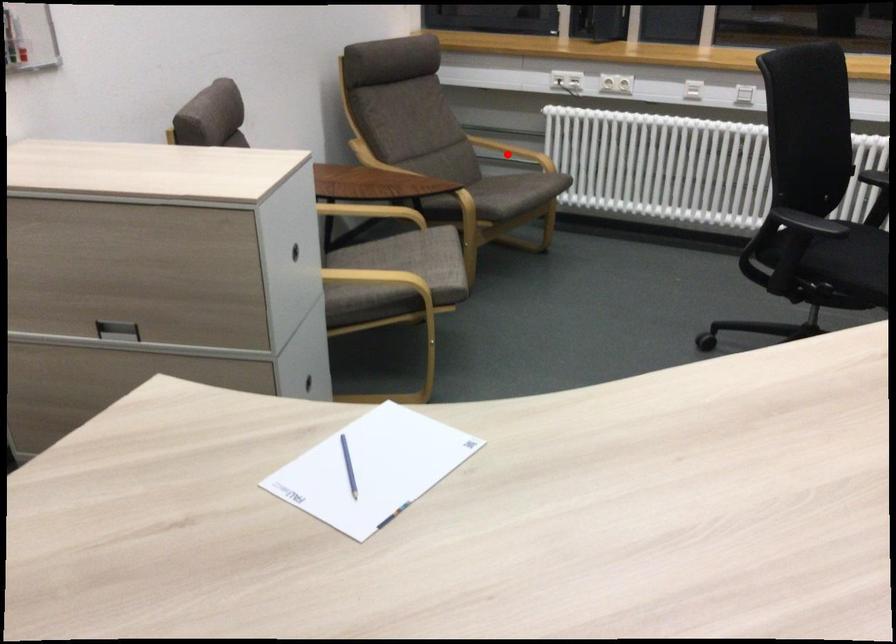
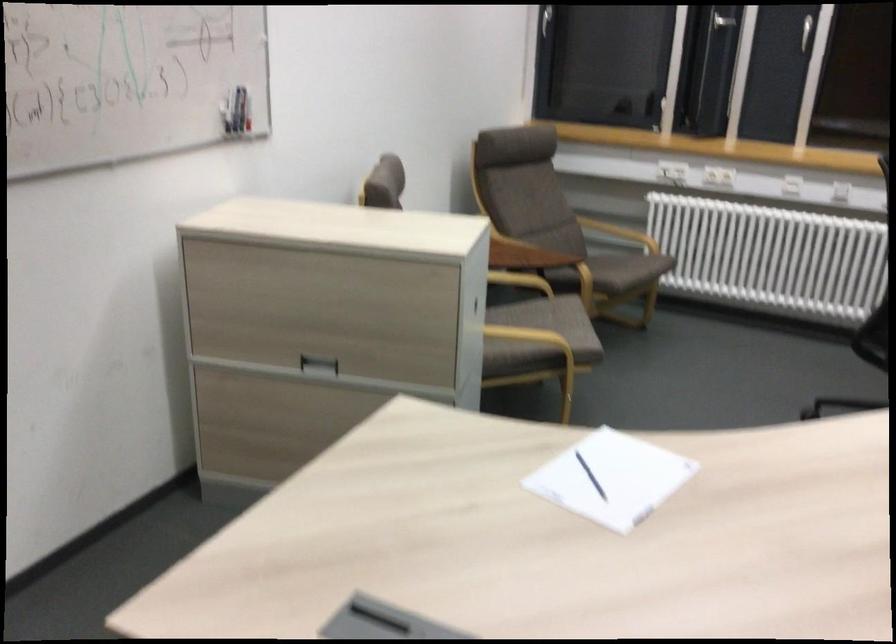
The point at the highlighted location is marked in the first image. Where is the corresponding point in the second image?

(619, 232)